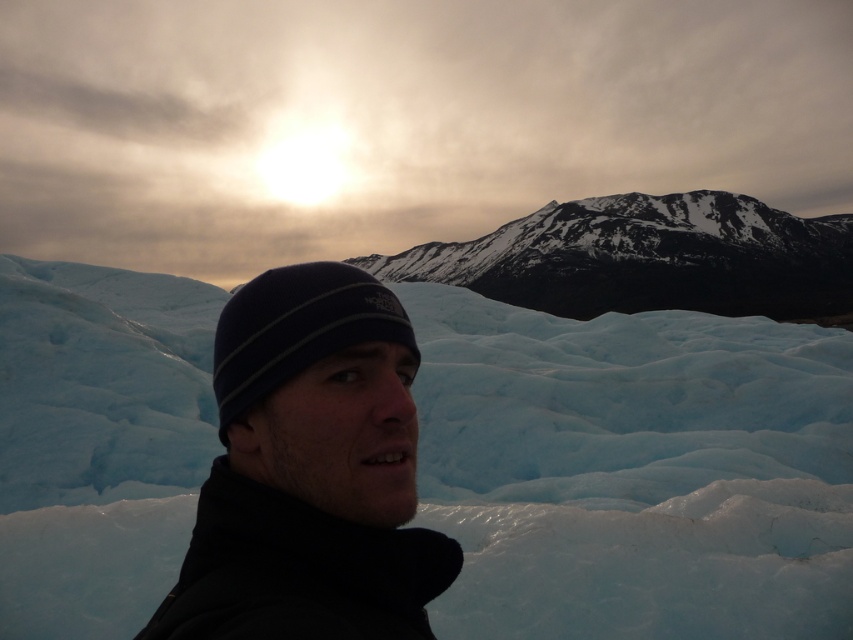
Question: Does snowy rocky mountain at center lie in front of black knit beanie at center?

Choices:
 (A) yes
 (B) no

Answer: (B)

Question: In this image, where is black knit cap at center located relative to snowy rocky mountain at center?

Choices:
 (A) below
 (B) above

Answer: (A)

Question: Which point is closer to the camera?

Choices:
 (A) black knit cap at center
 (B) blue ice glacier at center
 (C) black knit beanie at center
 (D) snowy rocky mountain at center

Answer: (A)

Question: Estimate the real-world distances between objects in this image. Which object is closer to the snowy rocky mountain at center?

Choices:
 (A) blue ice glacier at center
 (B) black knit cap at center

Answer: (A)

Question: Does black knit cap at center appear over black knit beanie at center?

Choices:
 (A) no
 (B) yes

Answer: (A)

Question: Which point is closer to the camera?

Choices:
 (A) blue ice glacier at center
 (B) black knit beanie at center

Answer: (B)